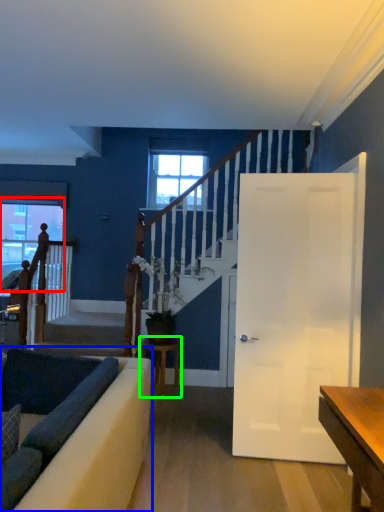
Question: Which object is the closest to the window (highlighted by a red box)? Choose among these: studio couch (highlighted by a blue box) or table (highlighted by a green box).

Choices:
 (A) studio couch
 (B) table

Answer: (B)